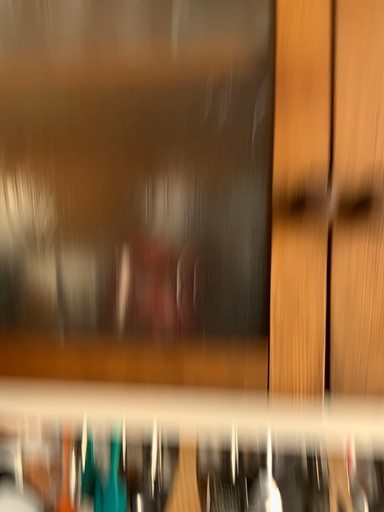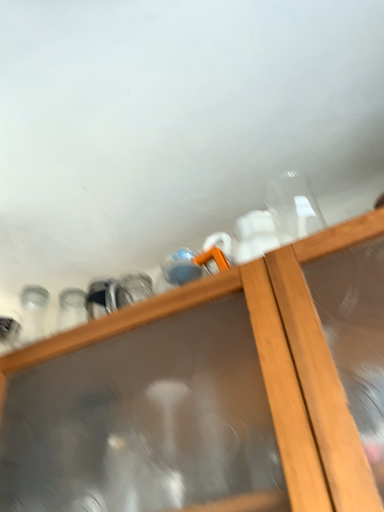
Question: Which way did the camera rotate in the video?

Choices:
 (A) rotated left
 (B) rotated right

Answer: (A)